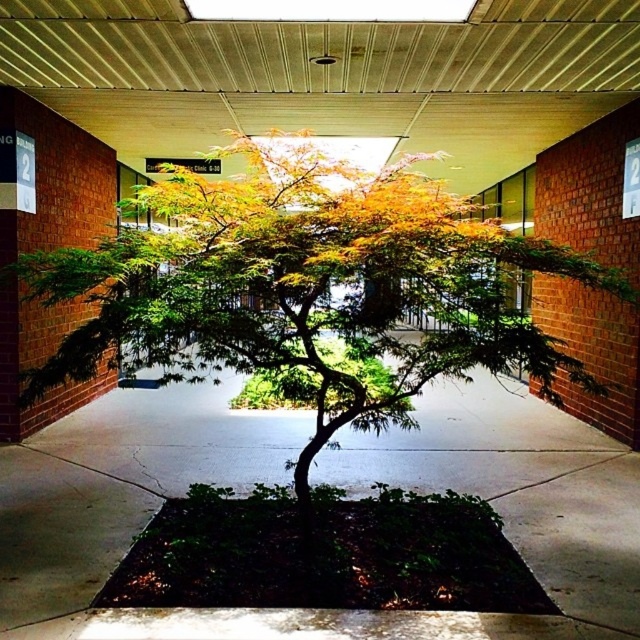
Can you confirm if green leafy tree at center is thinner than green concrete pavement at center?

In fact, green leafy tree at center might be wider than green concrete pavement at center.

Can you confirm if green leafy tree at center is smaller than green concrete pavement at center?

Actually, green leafy tree at center might be larger than green concrete pavement at center.

Who is more forward, (195, 275) or (54, 568)?

Point (195, 275) is in front.

Locate an element on the screen. The width and height of the screenshot is (640, 640). green leafy tree at center is located at coordinates (308, 291).